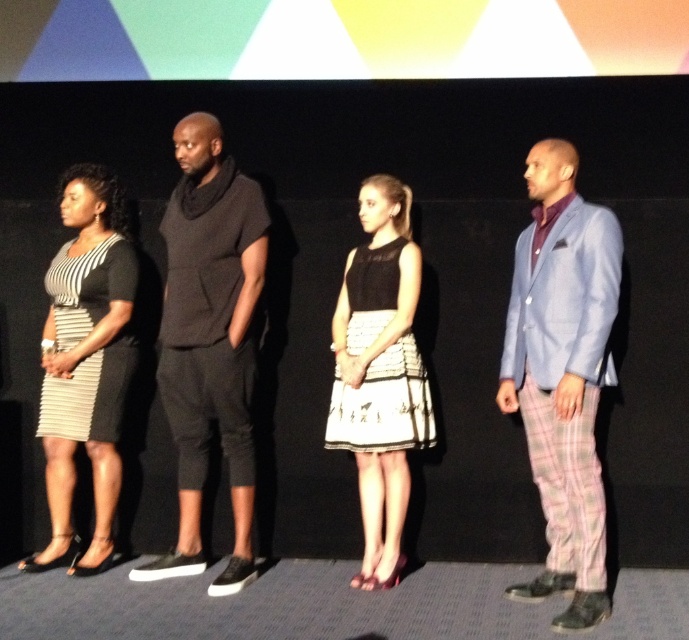
You are an event organizer arranging seating for a panel discussion. The seating arrangement requires that the person in the light blue fabric suit at right and the person in the black matte sweater at center be seated in order of their clothing width from narrowest to widest. Based on the image, how should you arrange their seating?

The light blue fabric suit at right has a lesser width compared to the black matte sweater at center, so the person in the light blue fabric suit at right should be seated first, followed by the person in the black matte sweater at center.